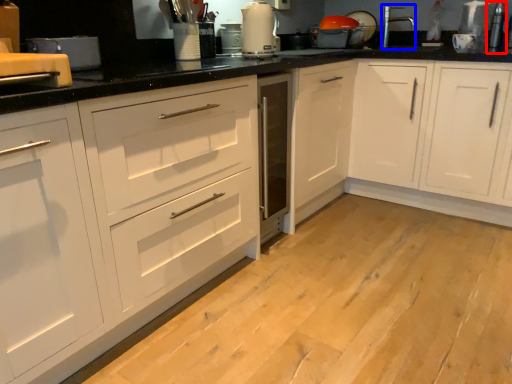
Question: Which object is further to the camera taking this photo, appliance (highlighted by a red box) or faucet (highlighted by a blue box)?

Choices:
 (A) appliance
 (B) faucet

Answer: (B)